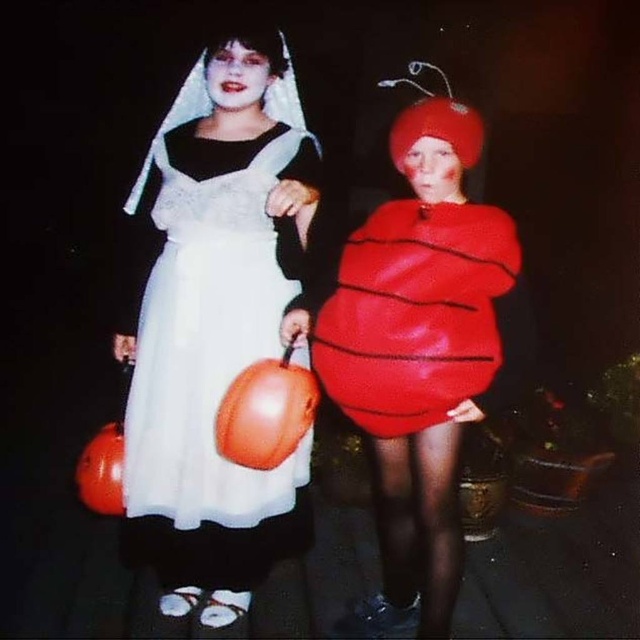
Is white satin dress at upper left to the left of rubberized red apple at center from the viewer's perspective?

Correct, you'll find white satin dress at upper left to the left of rubberized red apple at center.

You are a GUI agent. You are given a task and a screenshot of the screen. Output one action in this format:
    pyautogui.click(x=<x>, y=<y>)
    Task: Click on the white satin dress at upper left
    
    Given the screenshot: What is the action you would take?
    pyautogui.click(x=216, y=324)

Is white satin dress at upper left further to the viewer compared to matte red costume at center?

That is True.

Is point (301, 122) positioned after point (444, 481)?

Yes, it is.

The height and width of the screenshot is (640, 640). What are the coordinates of `white satin dress at upper left` in the screenshot? It's located at (216, 324).

Can you confirm if matte red costume at center is positioned to the left of rubberized red apple at center?

Indeed, matte red costume at center is positioned on the left side of rubberized red apple at center.

Does matte red costume at center have a larger size compared to rubberized red apple at center?

Yes.

Describe the element at coordinates (419, 353) in the screenshot. I see `matte red costume at center` at that location.

Where is `matte red costume at center`? This screenshot has height=640, width=640. matte red costume at center is located at coordinates (419, 353).